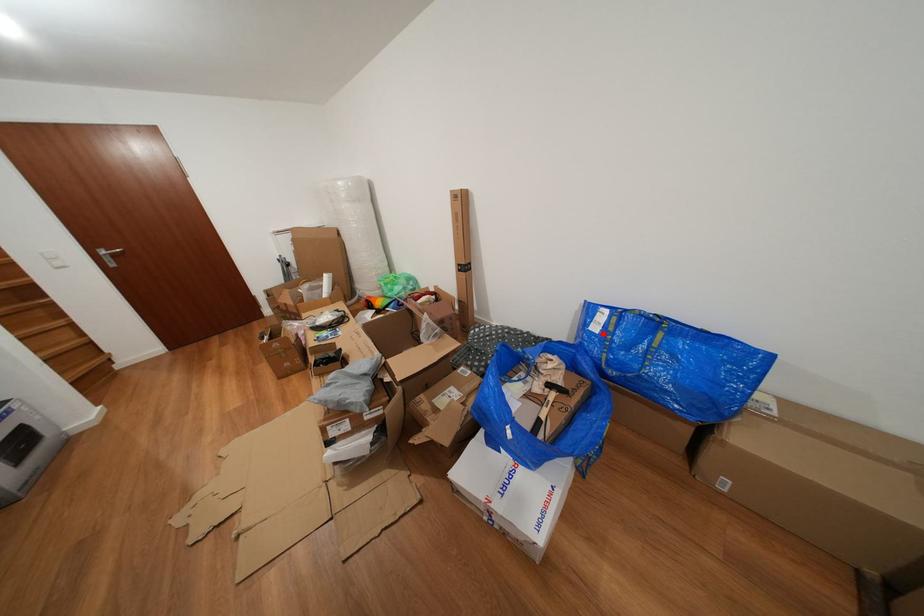
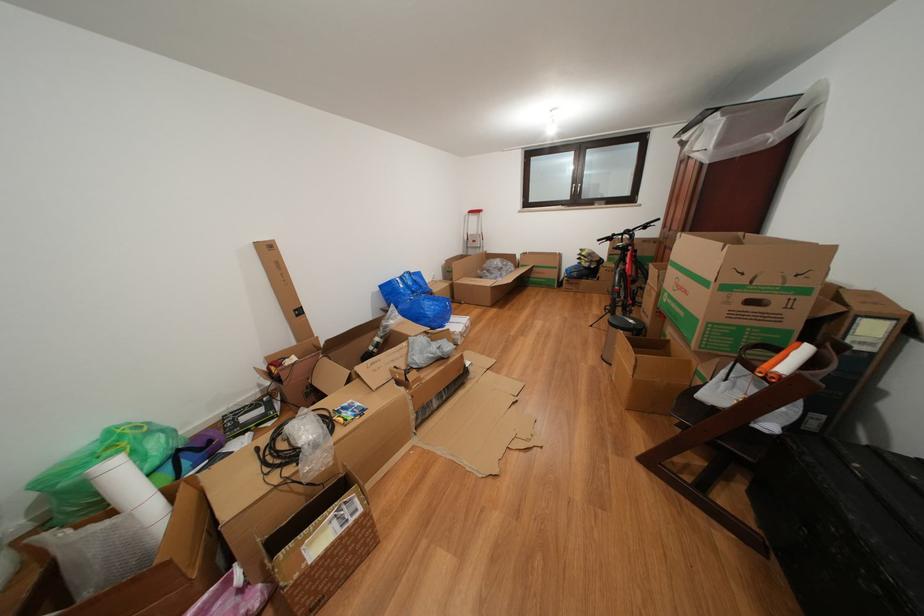
Question: I am providing you with two images of the same scene from different viewpoints. Given a red point in image1, look at the same physical point in image2. Is it:

Choices:
 (A) Closer to the viewpoint
 (B) Farther from the viewpoint

Answer: (B)